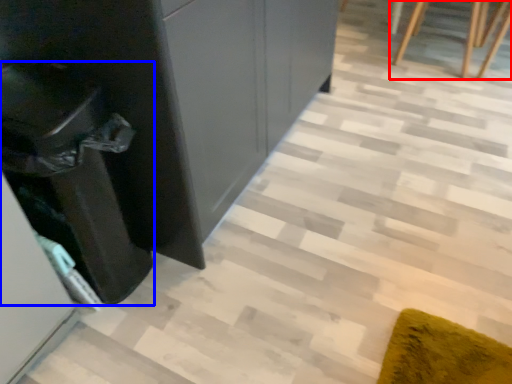
Question: Among these objects, which one is nearest to the camera, furniture (highlighted by a red box) or cabinetry (highlighted by a blue box)?

Choices:
 (A) furniture
 (B) cabinetry

Answer: (B)